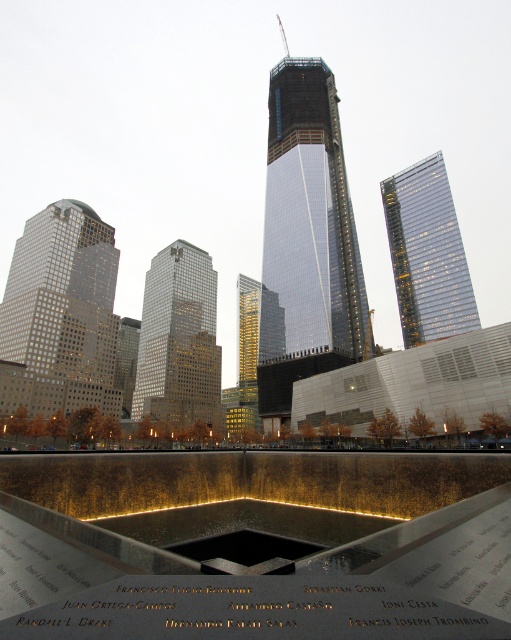
Does point (268, 144) lie in front of point (466, 278)?

No, it is behind (466, 278).

Can you confirm if glassy steel skyscraper at center is positioned to the right of glassy reflective skyscraper at center-right?

In fact, glassy steel skyscraper at center is to the left of glassy reflective skyscraper at center-right.

I want to click on glassy steel skyscraper at center, so click(x=311, y=212).

Based on the photo, is reflective metallic water at center bigger than glassy reflective skyscraper at center-right?

Actually, reflective metallic water at center might be smaller than glassy reflective skyscraper at center-right.

Can you confirm if reflective metallic water at center is shorter than glassy reflective skyscraper at center-right?

Yes, reflective metallic water at center is shorter than glassy reflective skyscraper at center-right.

Is point (88, 499) farther from viewer compared to point (415, 321)?

No, it is not.

Where is `reflective metallic water at center`? The image size is (511, 640). reflective metallic water at center is located at coordinates (254, 545).

Is glassy reflective skyscraper at center-right taller than gold reflective glass building at center?

Correct, glassy reflective skyscraper at center-right is much taller as gold reflective glass building at center.

Who is positioned more to the left, glassy reflective skyscraper at center-right or gold reflective glass building at center?

Positioned to the left is gold reflective glass building at center.

At what (x,y) coordinates should I click in order to perform the action: click on glassy reflective skyscraper at center-right. Please return your answer as a coordinate pair (x, y). This screenshot has height=640, width=511. Looking at the image, I should click on [x=427, y=253].